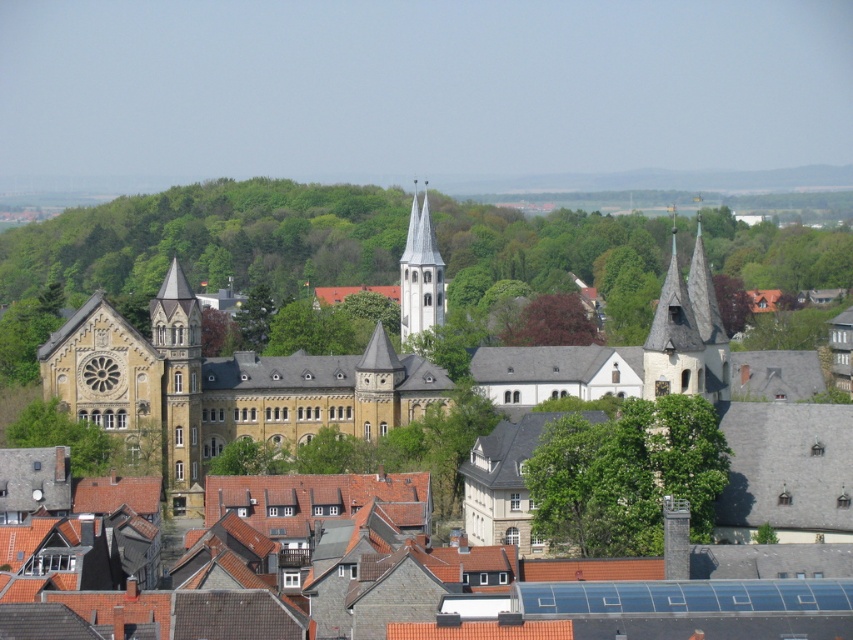
Question: Does golden stone church at center have a greater width compared to dark red leafy tree at center?

Choices:
 (A) no
 (B) yes

Answer: (B)

Question: Which point is closer to the camera?

Choices:
 (A) golden stone church at center
 (B) white stone spire at center

Answer: (A)

Question: Can you confirm if golden stone church at center is bigger than dark red leafy tree at center?

Choices:
 (A) yes
 (B) no

Answer: (A)

Question: Which object is closer to the camera taking this photo?

Choices:
 (A) yellow stone building at center
 (B) golden stone church at center
 (C) dark red leafy tree at center

Answer: (A)

Question: Is yellow stone building at center to the left of green leafy tree at center from the viewer's perspective?

Choices:
 (A) yes
 (B) no

Answer: (A)

Question: Which object is farther from the camera taking this photo?

Choices:
 (A) yellow stone building at center
 (B) golden stone church at center

Answer: (B)